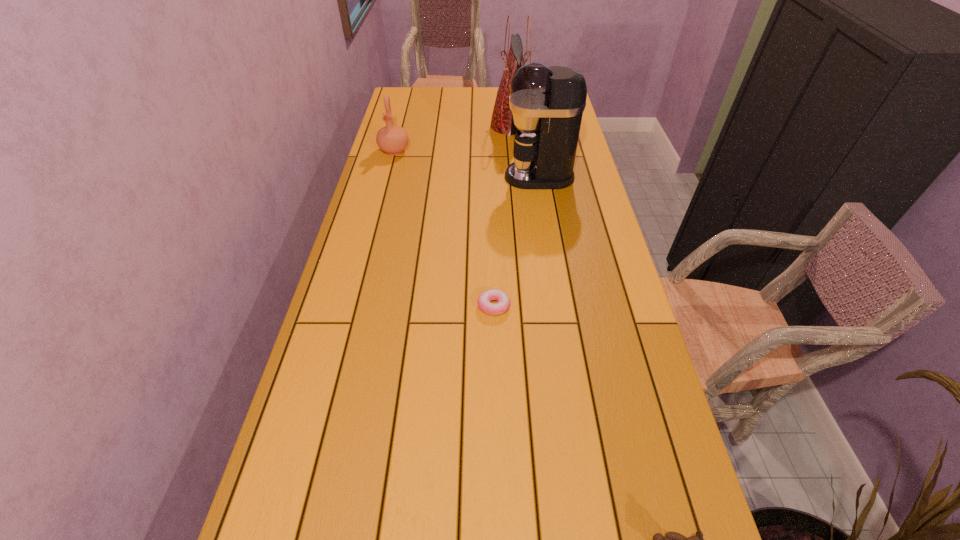
Where is `handbag`? handbag is located at coordinates (502, 121).

This screenshot has height=540, width=960. I want to click on coffee maker, so click(547, 103).

You are a GUI agent. You are given a task and a screenshot of the screen. Output one action in this format:
    pyautogui.click(x=<x>, y=<y>)
    Task: Click on the leftmost object
    Image resolution: width=960 pixels, height=540 pixels.
    Given the screenshot: What is the action you would take?
    pyautogui.click(x=392, y=139)

Locate an element on the screen. This screenshot has width=960, height=540. the third shortest object is located at coordinates (392, 139).

In order to click on the fourth farthest object in this screenshot , I will do `click(484, 300)`.

The image size is (960, 540). Find the location of `doughnut`. doughnut is located at coordinates (484, 300).

The width and height of the screenshot is (960, 540). In order to click on free space located 0.280m on the left of the handbag in this screenshot , I will do `click(423, 126)`.

The image size is (960, 540). I want to click on free space located place cup under the spout of the third farthest object, so click(420, 177).

At what (x,y) coordinates should I click in order to perform the action: click on free location located 0.200m place cup under the spout of the third farthest object. Please return your answer as a coordinate pair (x, y). Looking at the image, I should click on (448, 177).

I want to click on vacant space situated place cup under the spout of the third farthest object, so click(x=441, y=177).